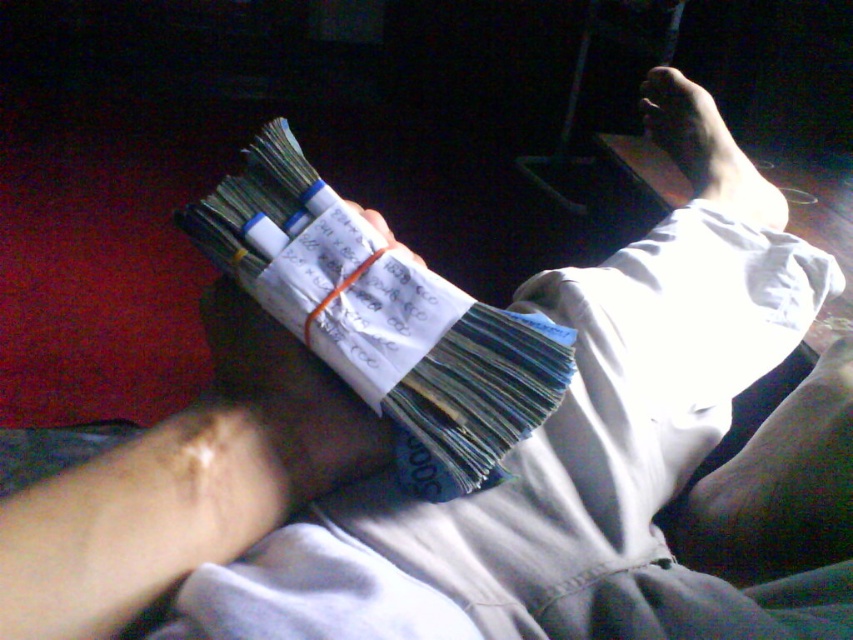
You are a delivery person who needs to confirm the location of the payment. You see the white paper money at center and the smooth skin foot at upper right. Which object is positioned lower in the image?

The white paper money at center is located below smooth skin foot at upper right.

You are a delivery person who needs to deliver a package to the exact location of the white paper money at center. According to the coordinates provided, where should you place the package?

The white paper money at center is located at coordinates point (384, 320), so you should place the package at that exact point.